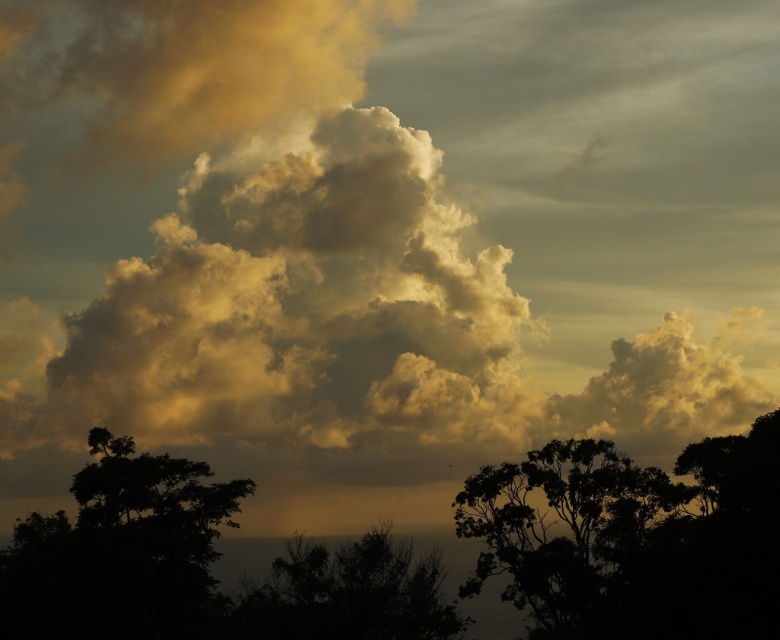
You are a bird flying at an altitude of 10 meters. You spot the silhouette leafy tree at lower right and the dark green leafy tree at center. Which tree is closer to your current position?

The silhouette leafy tree at lower right is closer to your current position because it is only 11.75 meters away from the dark green leafy tree at center, but since you are flying at 10 meters altitude, the vertical distance might affect the actual proximity. However, based on horizontal separation alone, the silhouette leafy tree at lower right is positioned further to the right and lower, so without exact coordinates, it is unclear which is closer. The given information only specifies their separation, so

You are an astronomer observing the sky scene. You notice a dark green leafy tree at lower left marked by point (119,548). Based on the scene description, where is this tree located relative to the clouds?

The dark green leafy tree at lower left marked by point (119,548) is located in the foreground of the scene, positioned below the clouds and closer to the observer compared to the clouds.

You are standing in a field and see the silhouette leafy tree at lower right and the dark green leafy tree at center. Which tree is closer to the right edge of the field?

The silhouette leafy tree at lower right is closer to the right edge of the field because it is positioned on the right side of the dark green leafy tree at center.